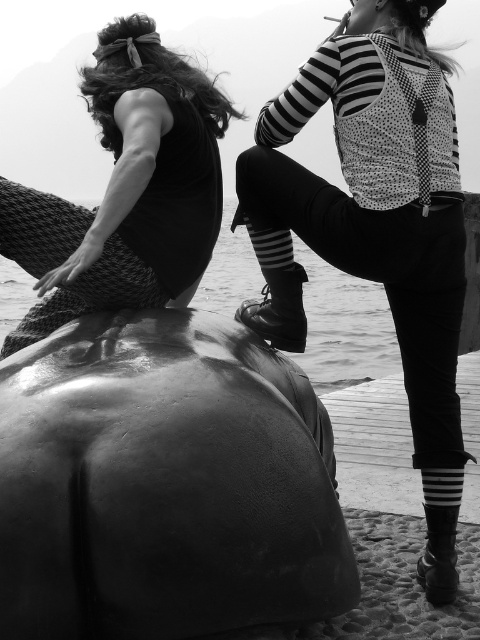
From the picture: Can you confirm if shiny dark gray humpback whale at lower left is positioned to the right of polka dot fabric backpack at upper right?

In fact, shiny dark gray humpback whale at lower left is to the left of polka dot fabric backpack at upper right.

Who is more forward, (146,369) or (405,371)?

Positioned in front is point (146,369).

Is point (168, 561) closer to viewer compared to point (288, 106)?

That is True.

Image resolution: width=480 pixels, height=640 pixels. I want to click on shiny dark gray humpback whale at lower left, so click(x=165, y=484).

Which is more to the left, polka dot fabric backpack at upper right or matte black dress at left?

Positioned to the left is matte black dress at left.

Does polka dot fabric backpack at upper right appear on the left side of matte black dress at left?

Incorrect, polka dot fabric backpack at upper right is not on the left side of matte black dress at left.

Measure the distance between polka dot fabric backpack at upper right and camera.

polka dot fabric backpack at upper right and camera are 3.61 meters apart.

Where is `polka dot fabric backpack at upper right`? This screenshot has height=640, width=480. polka dot fabric backpack at upper right is located at coordinates (374, 227).

Who is higher up, shiny dark gray humpback whale at lower left or matte black dress at left?

matte black dress at left is above.

Between shiny dark gray humpback whale at lower left and matte black dress at left, which one appears on the right side from the viewer's perspective?

Positioned to the right is shiny dark gray humpback whale at lower left.

The image size is (480, 640). What do you see at coordinates (165, 484) in the screenshot?
I see `shiny dark gray humpback whale at lower left` at bounding box center [165, 484].

What are the coordinates of `shiny dark gray humpback whale at lower left` in the screenshot? It's located at (165, 484).